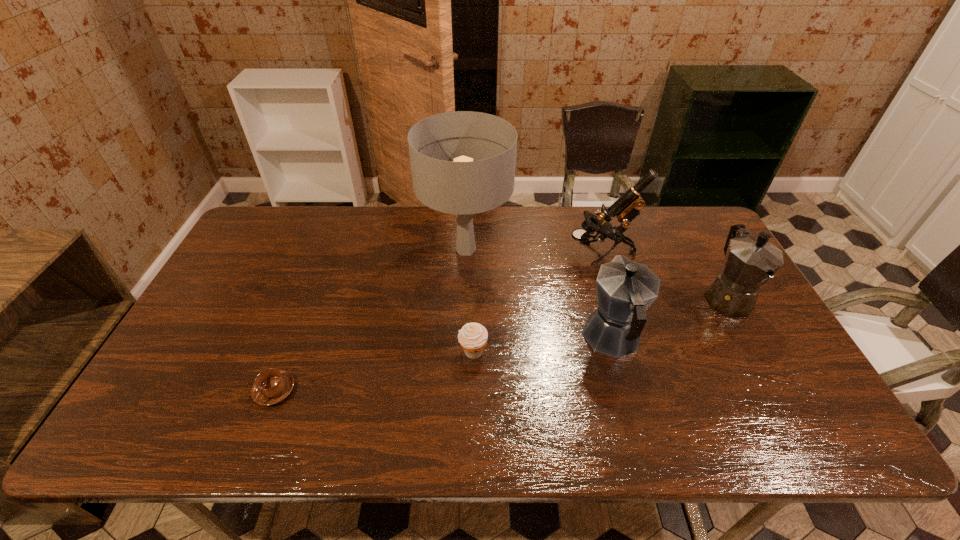
Identify the location of free space located through the eyepiece of the microscope. This screenshot has width=960, height=540. (510, 253).

The image size is (960, 540). I want to click on vacant area located at the spout of the left coffeepot, so click(x=588, y=249).

Locate an element on the screen. vacant point located 0.290m at the spout of the left coffeepot is located at coordinates (587, 242).

I want to click on free point located at the spout of the left coffeepot, so click(586, 238).

The width and height of the screenshot is (960, 540). What are the coordinates of `vacant space situated 0.080m on the pouring side of the right coffeepot` in the screenshot? It's located at (756, 350).

Find the location of a particular element. This screenshot has height=540, width=960. free space located 0.090m on the front of the second shortest object is located at coordinates (472, 395).

The width and height of the screenshot is (960, 540). Identify the location of free space located on the side of the nearest object with the handle. (253, 446).

You are a GUI agent. You are given a task and a screenshot of the screen. Output one action in this format:
    pyautogui.click(x=<x>, y=<y>)
    Task: Click on the lampshade that is at the far edge
    
    Given the screenshot: What is the action you would take?
    pyautogui.click(x=463, y=187)

You are a GUI agent. You are given a task and a screenshot of the screen. Output one action in this format:
    pyautogui.click(x=<x>, y=<y>)
    Task: Click on the microscope that is at the far edge
    
    Given the screenshot: What is the action you would take?
    pyautogui.click(x=627, y=207)

I want to click on object present at the right edge, so click(750, 262).